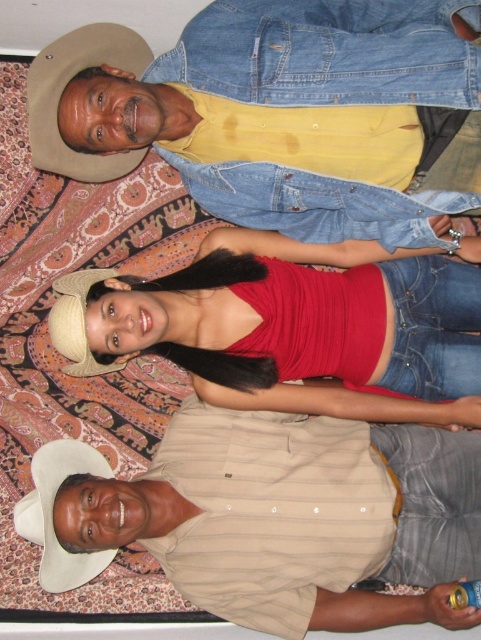
Question: Which point is closer to the camera?

Choices:
 (A) (295, 68)
 (B) (52, 116)
 (C) (477, 310)
 (D) (330, 515)

Answer: (A)

Question: Which object appears closest to the camera in this image?

Choices:
 (A) suede-like tan cowboy hat at upper left
 (B) matte red tank top at center

Answer: (A)

Question: Which of the following is the closest to the observer?

Choices:
 (A) (139, 58)
 (B) (238, 465)

Answer: (A)

Question: Is tan striped shirt at lower center to the left of matte red tank top at center from the viewer's perspective?

Choices:
 (A) no
 (B) yes

Answer: (B)

Question: From the image, what is the correct spatial relationship of tan striped shirt at lower center in relation to suede-like tan cowboy hat at upper left?

Choices:
 (A) left
 (B) right

Answer: (B)

Question: Is denim jacket at upper center smaller than matte red tank top at center?

Choices:
 (A) yes
 (B) no

Answer: (B)